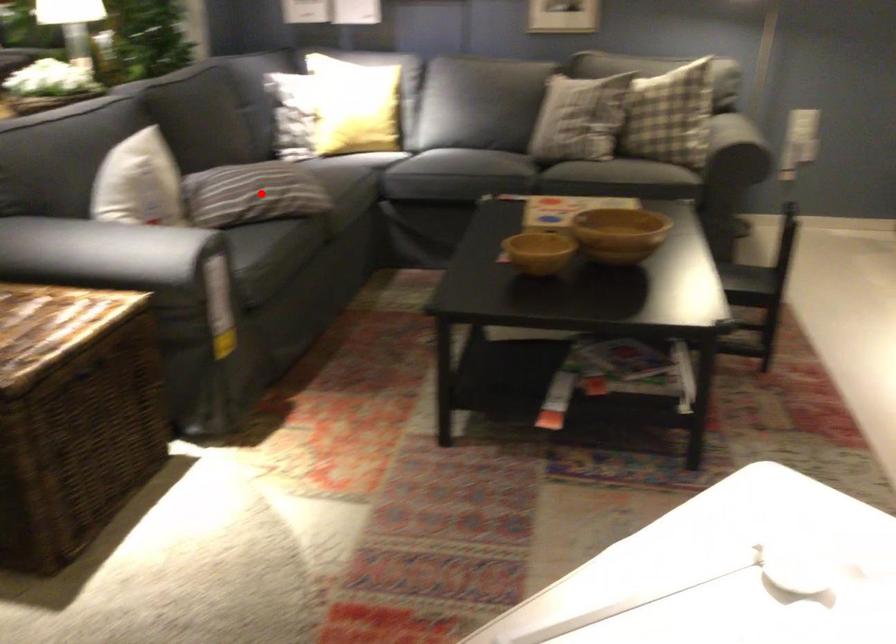
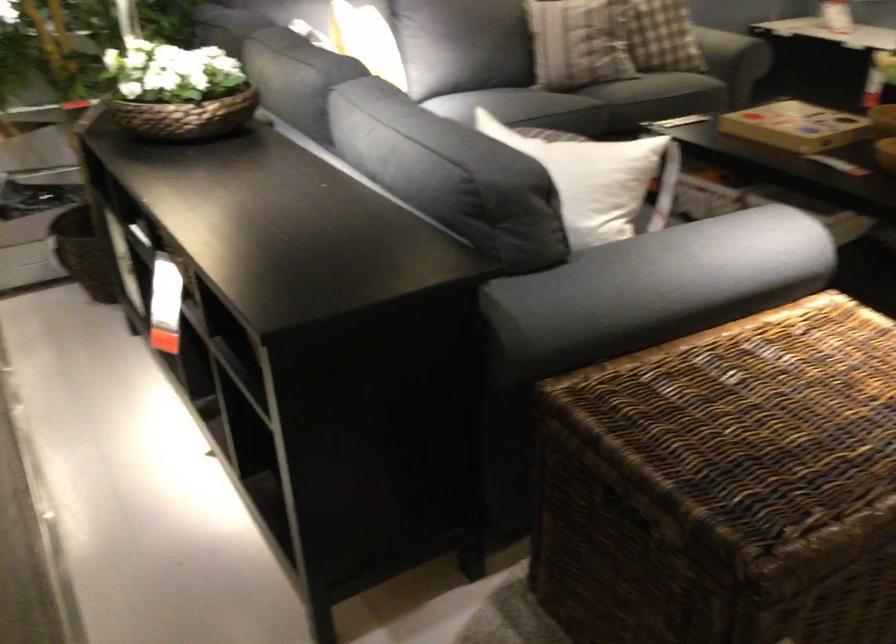
Question: I am providing you with two images of the same scene from different viewpoints. A red point is marked on the first image. Can you still see the location of the red point in image 2?

Choices:
 (A) Yes
 (B) No

Answer: (B)